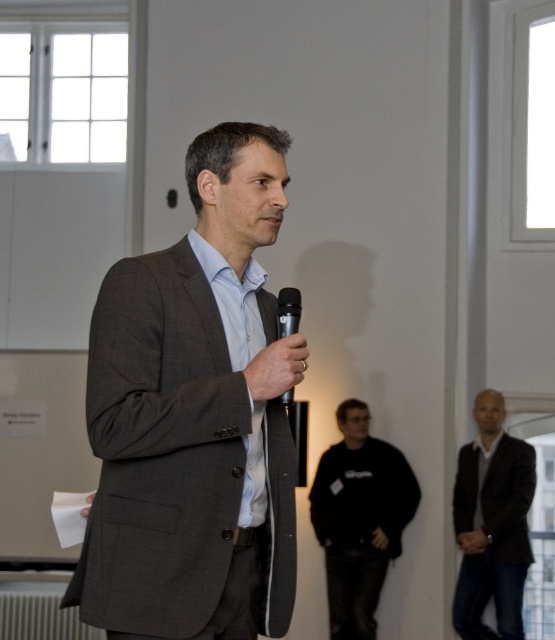
Which is more to the left, dark brown leather jacket at lower right or black metallic microphone at center?

black metallic microphone at center is more to the left.

What do you see at coordinates (491, 524) in the screenshot? The image size is (555, 640). I see `dark brown leather jacket at lower right` at bounding box center [491, 524].

Describe the element at coordinates (491, 524) in the screenshot. This screenshot has height=640, width=555. I see `dark brown leather jacket at lower right` at that location.

Locate an element on the screen. dark brown leather jacket at lower right is located at coordinates (491, 524).

From the picture: Between dark gray suit at center and black metallic microphone at center, which one appears on the left side from the viewer's perspective?

Positioned to the left is dark gray suit at center.

The image size is (555, 640). What are the coordinates of `dark gray suit at center` in the screenshot? It's located at (194, 417).

Looking at this image, is black matte sweatshirt at center thinner than black metallic microphone at center?

In fact, black matte sweatshirt at center might be wider than black metallic microphone at center.

Between black matte sweatshirt at center and black metallic microphone at center, which one has more height?

Standing taller between the two is black matte sweatshirt at center.

Locate an element on the screen. The width and height of the screenshot is (555, 640). black matte sweatshirt at center is located at coordinates (360, 518).

Find the location of a particular element. black matte sweatshirt at center is located at coordinates (360, 518).